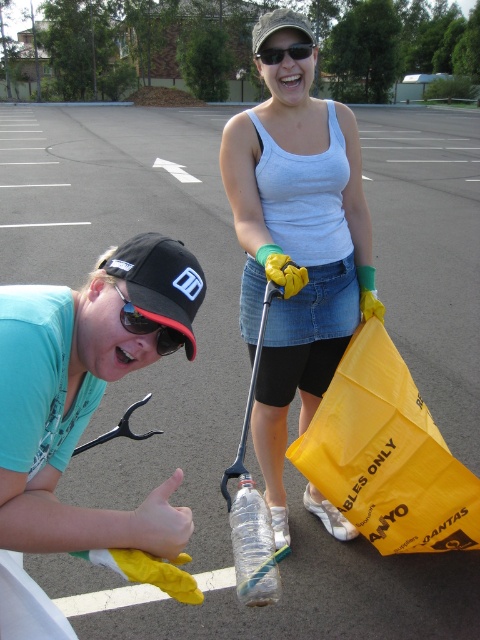
You are a volunteer in the parking lot cleanup. You see a transparent plastic bottle at center and a camouflage fabric baseball cap at upper center. Which object is closer to you?

The transparent plastic bottle at center is closer to you because it is in front of the camouflage fabric baseball cap at upper center.

You are a park visitor trying to locate the black plastic goggles at lower left. You see the denim skirt at center. Which direction should you move to find the goggles?

The denim skirt at center is positioned on the right side of black plastic goggles at lower left. To find the black plastic goggles at lower left, you should move to the left from the denim skirt at center.